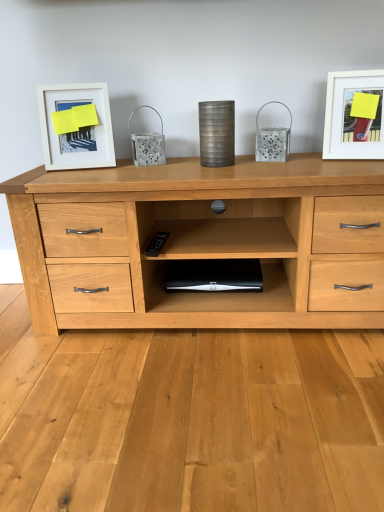
What are the coordinates of `empty space that is ontop of black plastic computer at center (from a real-world perspective)` in the screenshot? It's located at (210, 273).